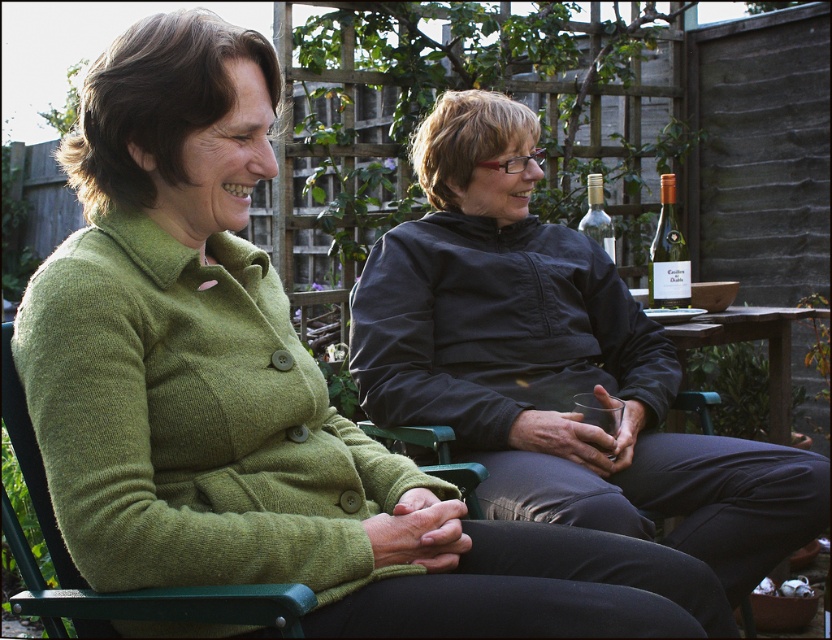
Question: Which of the following is the closest to the observer?

Choices:
 (A) translucent glass wine bottle at right
 (B) clear glass bottle at upper right

Answer: (B)

Question: Which point appears closest to the camera in this image?

Choices:
 (A) (592, 236)
 (B) (660, 248)
 (C) (461, 138)

Answer: (C)

Question: Is translucent glass wine bottle at right below clear glass bottle at upper right?

Choices:
 (A) yes
 (B) no

Answer: (A)

Question: Can you confirm if matte black jacket at center is wider than clear glass bottle at upper right?

Choices:
 (A) yes
 (B) no

Answer: (A)

Question: Can you confirm if matte black jacket at center is positioned below clear glass bottle at upper right?

Choices:
 (A) yes
 (B) no

Answer: (A)

Question: Which of the following is the farthest from the observer?

Choices:
 (A) (676, 273)
 (B) (449, 388)
 (C) (593, 205)

Answer: (C)